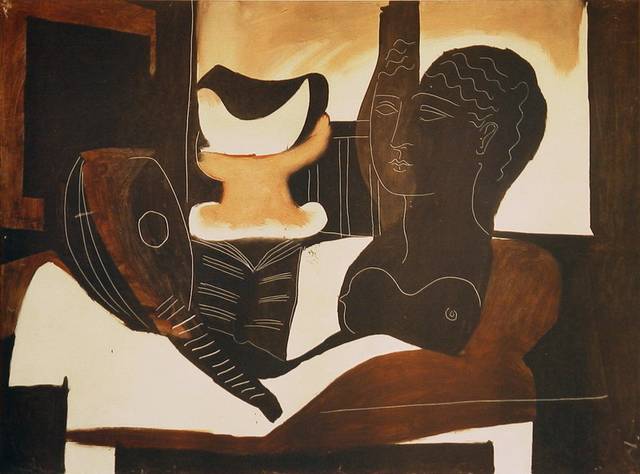
Where is `pedestal`? The image size is (640, 474). pedestal is located at coordinates (257, 188).